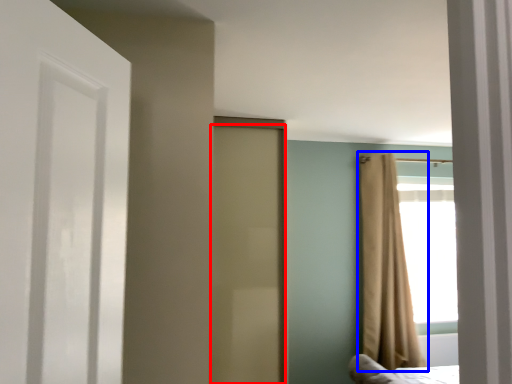
Question: Which object is closer to the camera taking this photo, door (highlighted by a red box) or curtain (highlighted by a blue box)?

Choices:
 (A) door
 (B) curtain

Answer: (A)